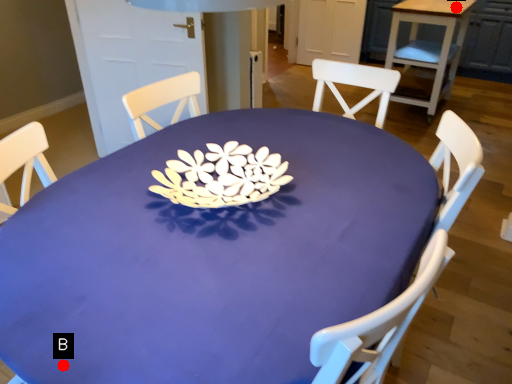
Question: Two points are circled on the image, labeled by A and B beside each circle. Among these points, which one is farthest from the camera?

Choices:
 (A) A is further
 (B) B is further

Answer: (A)